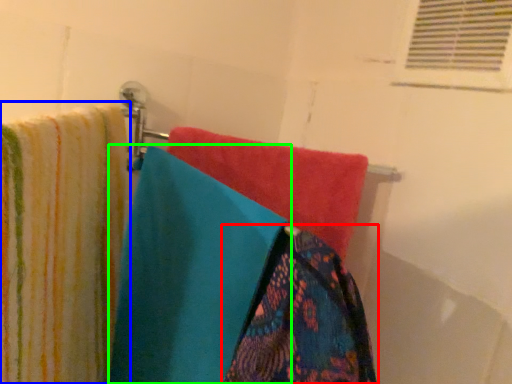
Question: Which is farther away from towel (highlighted by a red box)? towel (highlighted by a blue box) or towel (highlighted by a green box)?

Choices:
 (A) towel
 (B) towel

Answer: (A)